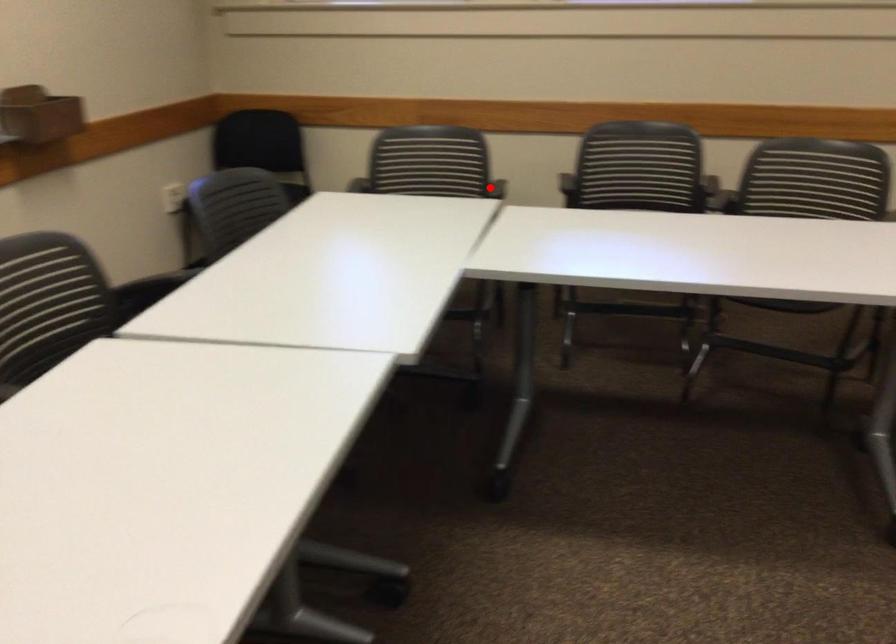
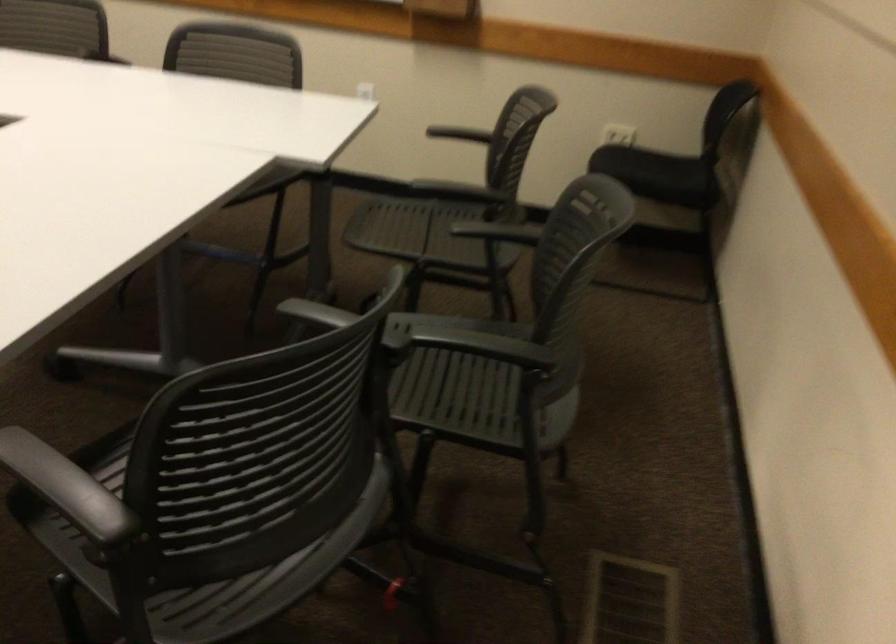
Find the pixel in the second image that matches the highlighted location in the first image.

(461, 190)